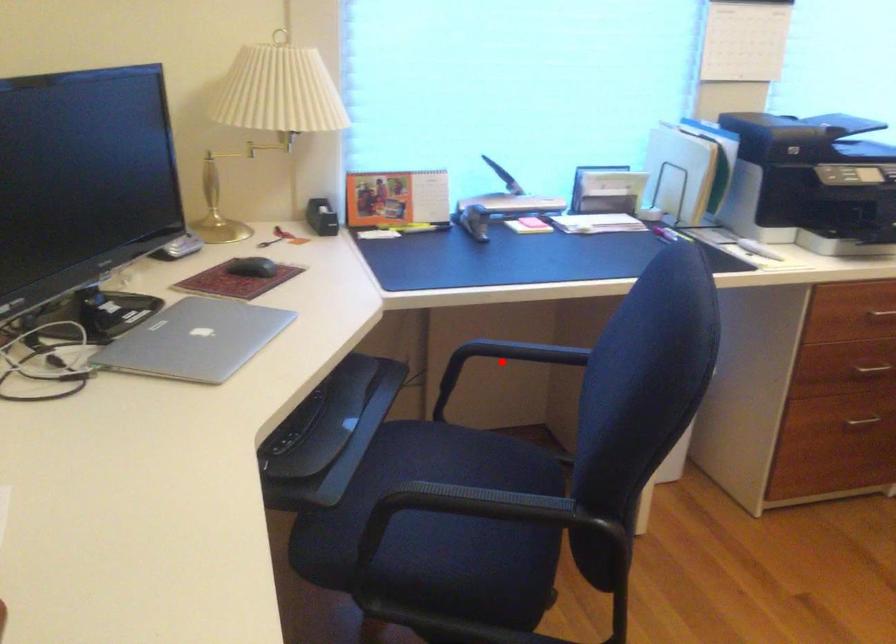
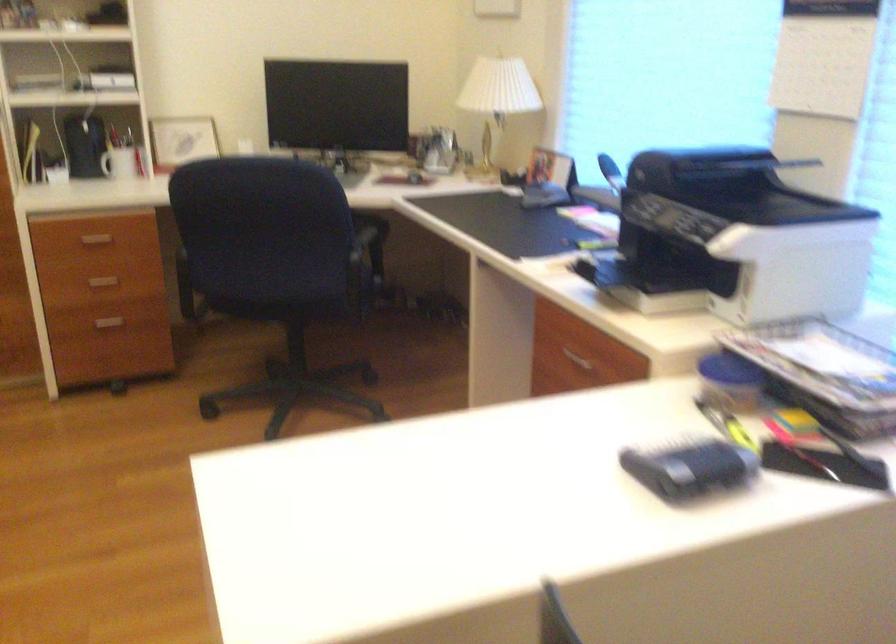
Question: I am providing you with two images of the same scene from different viewpoints. A red point is marked on the first image. Can you still see the location of the red point in image 2?

Choices:
 (A) Yes
 (B) No

Answer: (B)